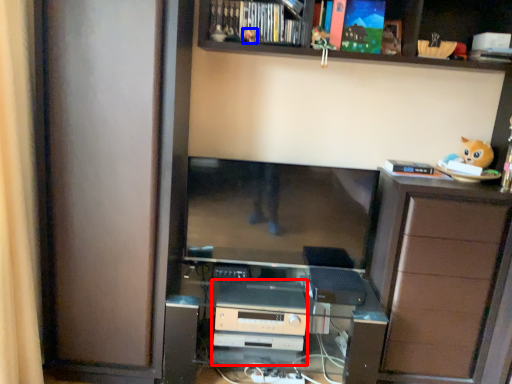
Question: Which point is closer to the camera, appliance (highlighted by a red box) or toy (highlighted by a blue box)?

Choices:
 (A) appliance
 (B) toy

Answer: (B)